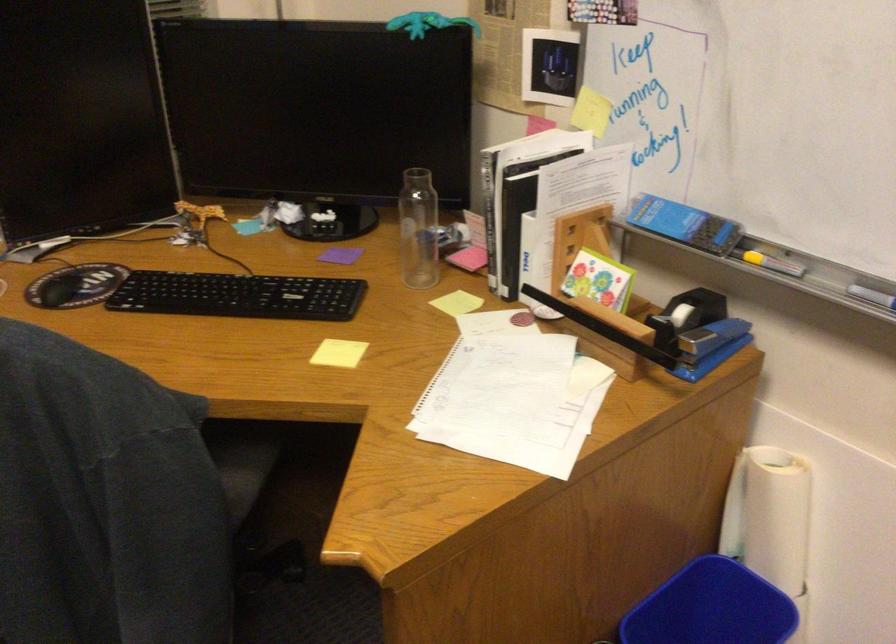
In order to click on stapler handle in this screenshot , I will do `click(710, 346)`.